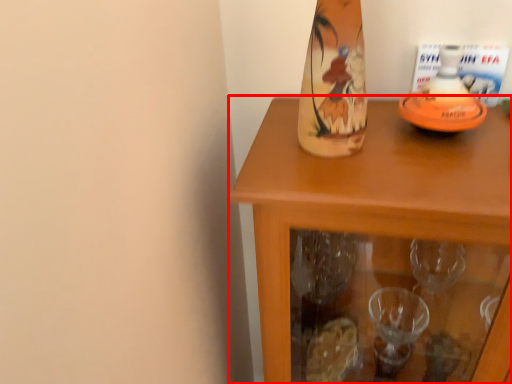
Question: From the image's perspective, where is table (annotated by the red box) located relative to bottle?

Choices:
 (A) below
 (B) above

Answer: (A)